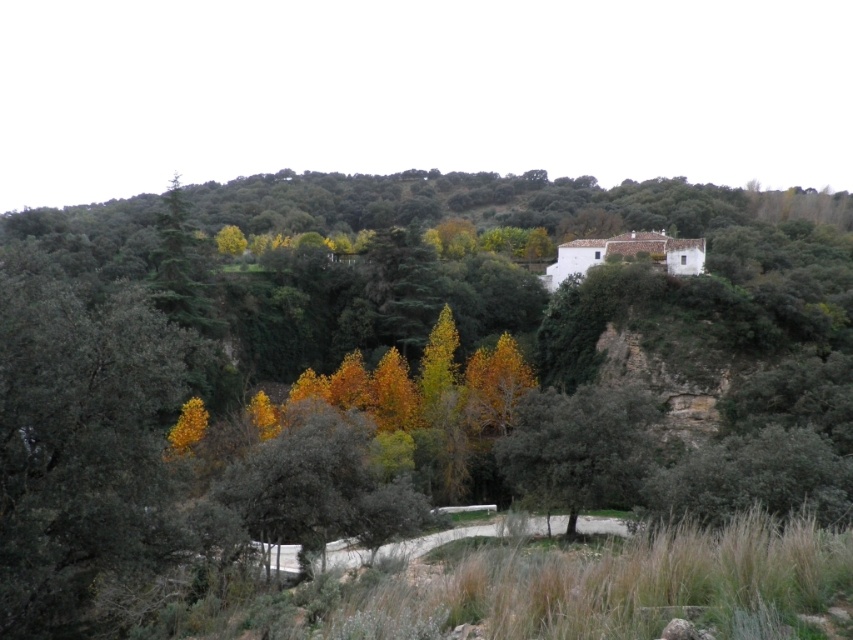
Is point (12, 227) positioned after point (587, 388)?

Yes, it is behind point (587, 388).

Between point (200, 588) and point (630, 472), which one is positioned in front?

Point (200, 588)

This screenshot has height=640, width=853. I want to click on yellow-green leaves at upper center, so click(389, 388).

Can you confirm if yellow-green leafy tree at left is thinner than green rough bark tree at center?

In fact, yellow-green leafy tree at left might be wider than green rough bark tree at center.

Between yellow-green leafy tree at left and green rough bark tree at center, which one has more height?

With more height is yellow-green leafy tree at left.

Does point (55, 577) come behind point (577, 470)?

No, (55, 577) is in front of (577, 470).

I want to click on yellow-green leafy tree at left, so click(80, 442).

Which of these two, yellow-green leaves at upper center or yellow-green leafy tree at left, stands shorter?

yellow-green leafy tree at left is shorter.

Describe the element at coordinates (389, 388) in the screenshot. I see `yellow-green leaves at upper center` at that location.

Find the location of a particular element. yellow-green leaves at upper center is located at coordinates (389, 388).